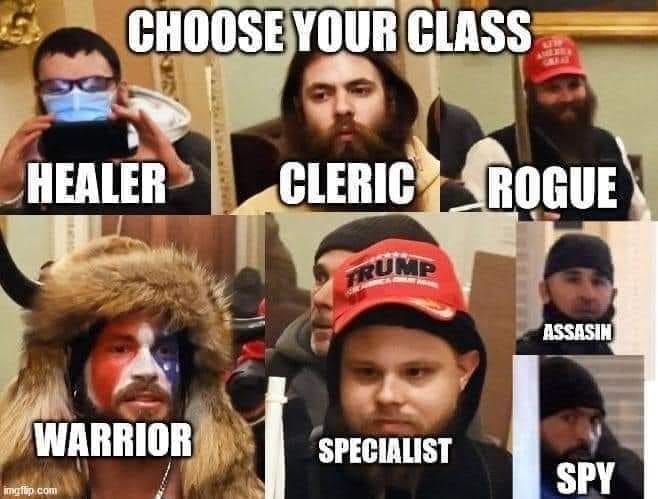
This screenshot has width=658, height=499. I want to click on wall, so click(x=637, y=86), click(x=257, y=79), click(x=5, y=88), click(x=24, y=249), click(x=305, y=228).